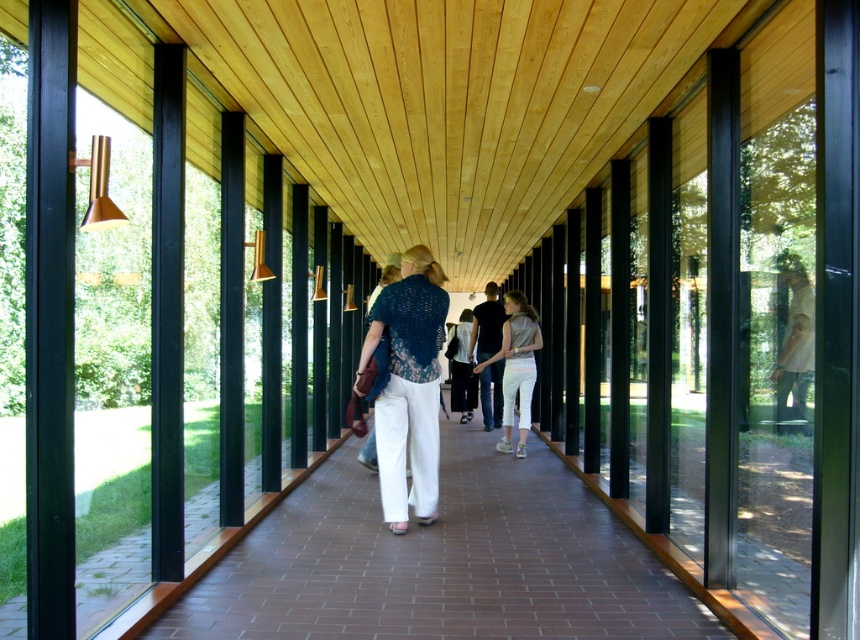
Question: Is the position of knitted blue blouse at center less distant than that of dark blue shirt at center?

Choices:
 (A) no
 (B) yes

Answer: (B)

Question: Is brown brick path at center bigger than light beige cotton pants at center?

Choices:
 (A) no
 (B) yes

Answer: (A)

Question: Which point is farther from the camera taking this photo?

Choices:
 (A) (425, 269)
 (B) (470, 385)
 (C) (450, 476)
 (D) (525, 310)

Answer: (B)

Question: Is light beige cotton pants at center to the right of white cotton pants at center from the viewer's perspective?

Choices:
 (A) no
 (B) yes

Answer: (B)

Question: Which object is closer to the camera taking this photo?

Choices:
 (A) light beige cotton pants at center
 (B) brown brick path at center
 (C) knitted blue blouse at center

Answer: (B)

Question: Which object is farther from the camera taking this photo?

Choices:
 (A) knitted blue blouse at center
 (B) light beige cotton pants at center
 (C) brown brick path at center
 (D) white cotton pants at center

Answer: (D)